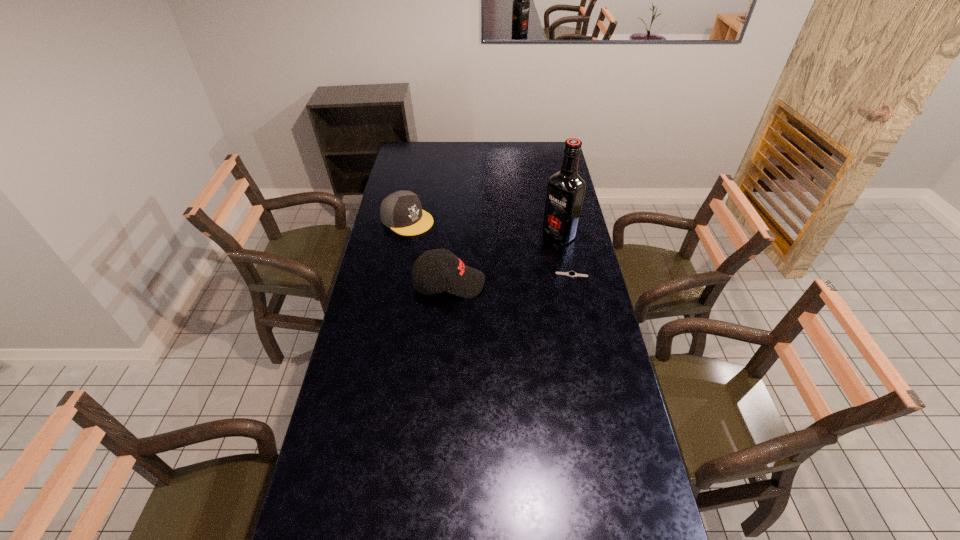
Find the location of a particular element. vacant space on the desktop that is between the baseball cap and the watch and is positioned on the front-facing side of the tallest object is located at coordinates (495, 280).

What are the coordinates of `free space on the desktop that is between the second tallest object and the watch and is positioned on the front-facing side of the cap` in the screenshot? It's located at (508, 279).